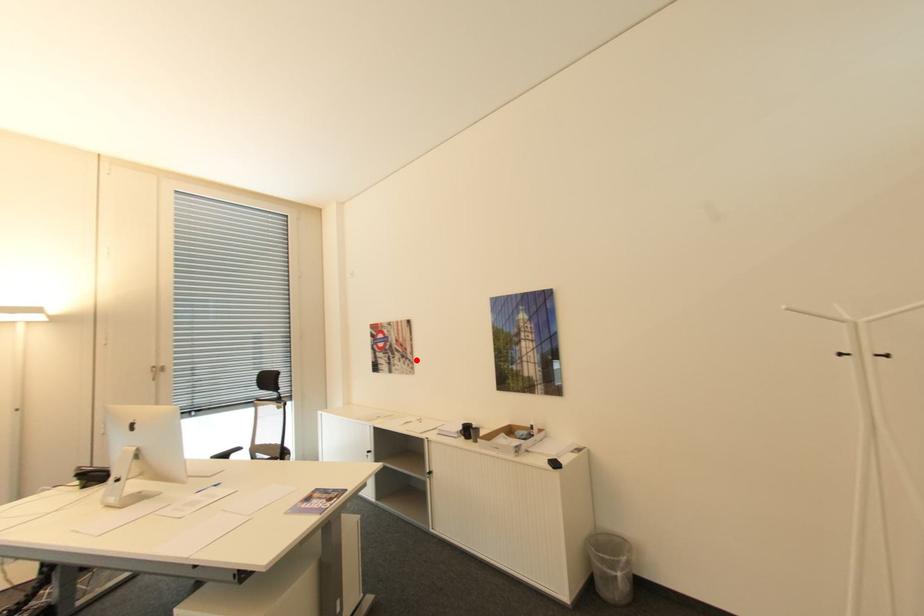
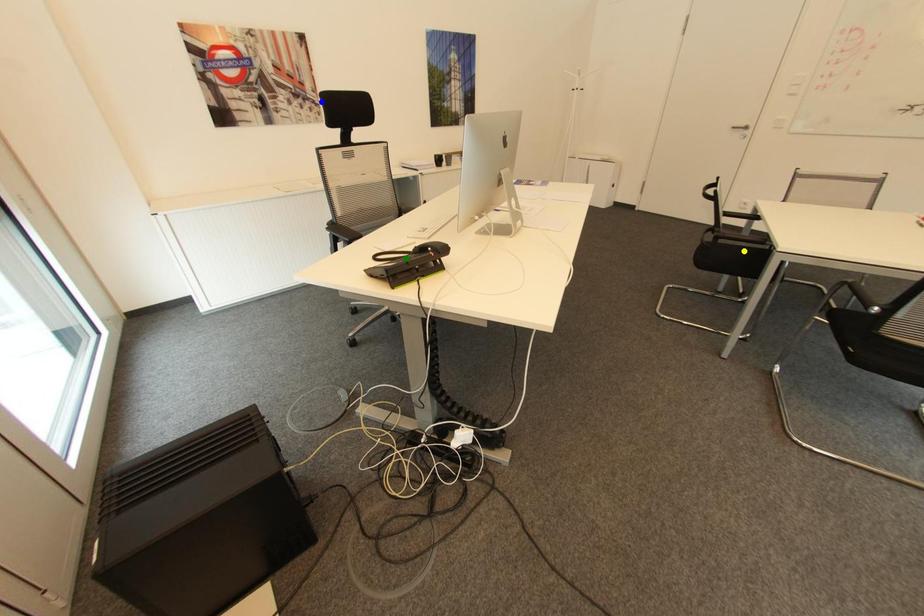
Question: I am providing you with two images of the same scene from different viewpoints. A red point is marked on the first image. You are given multiple points on the second image. Which spot in image 2 lines up with the point in image 1?

Choices:
 (A) blue point
 (B) green point
 (C) yellow point

Answer: (A)